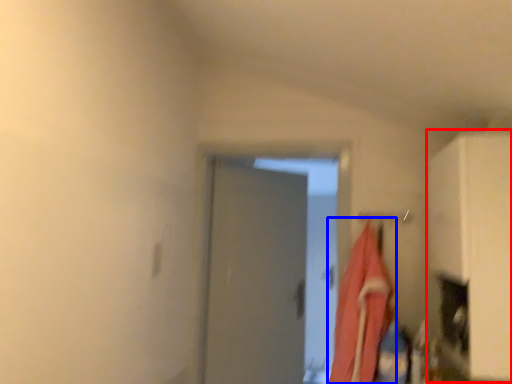
Question: Which point is further to the camera, cabinetry (highlighted by a red box) or laundry (highlighted by a blue box)?

Choices:
 (A) cabinetry
 (B) laundry

Answer: (B)